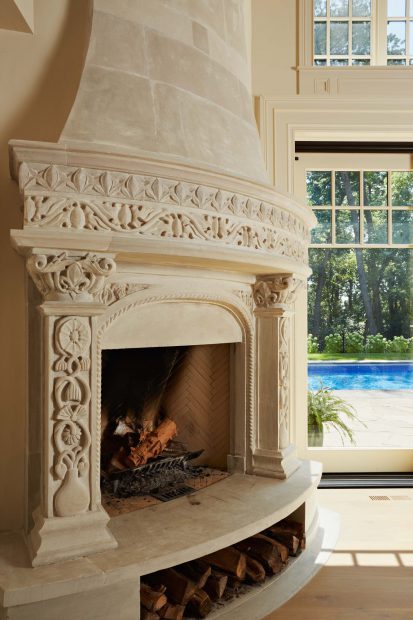
I want to click on back wall, so click(259, 6), click(285, 15), click(286, 74).